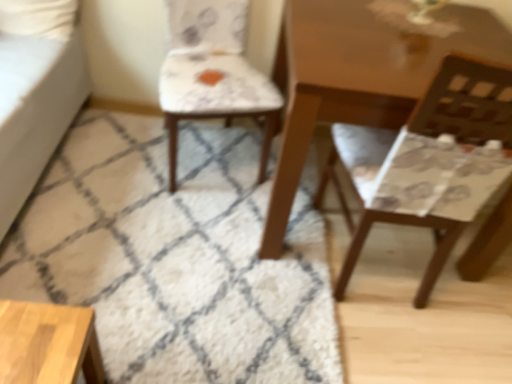
Question: From the image's perspective, would you say matte brown chair at right, the 2th chair when ordered from left to right, is shown under white shaggy rug at center?

Choices:
 (A) yes
 (B) no

Answer: (B)

Question: Considering the relative sizes of matte brown chair at right, marked as the 1th chair in a right-to-left arrangement, and white shaggy rug at center in the image provided, is matte brown chair at right, marked as the 1th chair in a right-to-left arrangement, wider than white shaggy rug at center?

Choices:
 (A) no
 (B) yes

Answer: (A)

Question: Is matte brown chair at right, the 2th chair when ordered from left to right, further to camera compared to white shaggy rug at center?

Choices:
 (A) yes
 (B) no

Answer: (B)

Question: From the image's perspective, is matte brown chair at right, the 2th chair when ordered from left to right, located above white shaggy rug at center?

Choices:
 (A) no
 (B) yes

Answer: (B)

Question: Does matte brown chair at right, marked as the 1th chair in a right-to-left arrangement, have a larger size compared to white shaggy rug at center?

Choices:
 (A) no
 (B) yes

Answer: (B)

Question: Which is correct: matte brown chair at right, marked as the 1th chair in a right-to-left arrangement, is inside white shaggy rug at center, or outside of it?

Choices:
 (A) inside
 (B) outside

Answer: (B)

Question: Is matte brown chair at right, the 2th chair when ordered from left to right, wider or thinner than white shaggy rug at center?

Choices:
 (A) wide
 (B) thin

Answer: (B)

Question: Is matte brown chair at right, the 2th chair when ordered from left to right, in front of or behind white shaggy rug at center in the image?

Choices:
 (A) behind
 (B) front

Answer: (B)

Question: Does point (472, 195) appear closer or farther from the camera than point (79, 183)?

Choices:
 (A) closer
 (B) farther

Answer: (A)

Question: In the image, is matte brown chair at right, the 2th chair when ordered from left to right, on the left side or the right side of patterned fabric chair at center, the second chair viewed from the right?

Choices:
 (A) right
 (B) left

Answer: (A)

Question: Is matte brown chair at right, the 2th chair when ordered from left to right, inside or outside of patterned fabric chair at center, the second chair viewed from the right?

Choices:
 (A) outside
 (B) inside

Answer: (A)

Question: In terms of size, does matte brown chair at right, the 2th chair when ordered from left to right, appear bigger or smaller than patterned fabric chair at center, the first chair in the left-to-right sequence?

Choices:
 (A) big
 (B) small

Answer: (A)

Question: In terms of width, does matte brown chair at right, the 2th chair when ordered from left to right, look wider or thinner when compared to patterned fabric chair at center, the second chair viewed from the right?

Choices:
 (A) thin
 (B) wide

Answer: (A)

Question: Which is correct: patterned fabric chair at center, the second chair viewed from the right, is inside matte brown chair at right, the 2th chair when ordered from left to right, or outside of it?

Choices:
 (A) inside
 (B) outside

Answer: (B)

Question: From a real-world perspective, is patterned fabric chair at center, the first chair in the left-to-right sequence, positioned above or below matte brown chair at right, marked as the 1th chair in a right-to-left arrangement?

Choices:
 (A) above
 (B) below

Answer: (B)